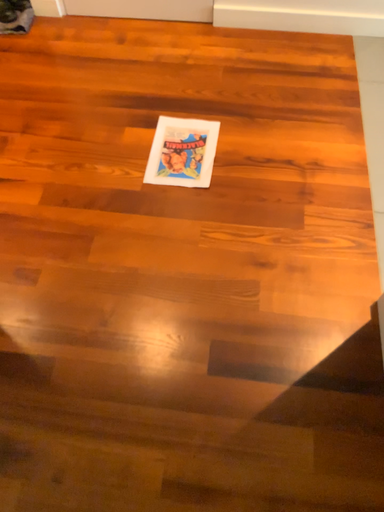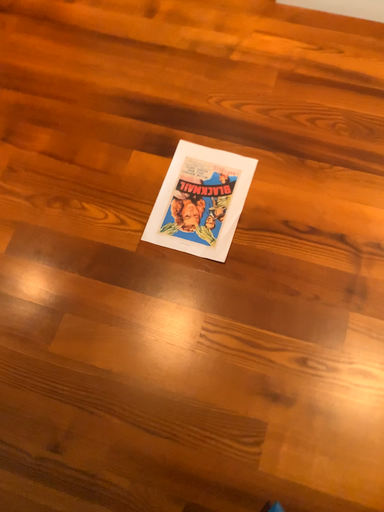
Question: Which way did the camera rotate in the video?

Choices:
 (A) rotated upward
 (B) rotated downward

Answer: (B)